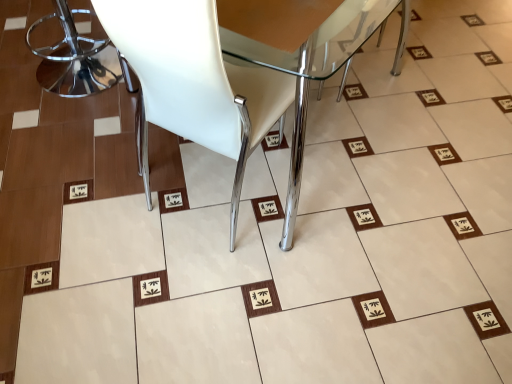
This screenshot has width=512, height=384. Describe the element at coordinates (229, 76) in the screenshot. I see `white matte chair at center, which appears as the first chair when viewed from the right` at that location.

In order to click on white matte chair at center, which appears as the first chair when viewed from the right in this screenshot , I will do `click(229, 76)`.

What do you see at coordinates (76, 59) in the screenshot? The height and width of the screenshot is (384, 512). I see `polished chrome bar stool at left, the 2th chair positioned from the right` at bounding box center [76, 59].

Locate an element on the screen. The width and height of the screenshot is (512, 384). polished chrome bar stool at left, the 2th chair positioned from the right is located at coordinates (76, 59).

Locate an element on the screen. The width and height of the screenshot is (512, 384). white matte chair at center, which is the second chair in left-to-right order is located at coordinates (229, 76).

Considering the relative positions of polished chrome bar stool at left, the 2th chair positioned from the right, and white matte chair at center, which appears as the first chair when viewed from the right, in the image provided, is polished chrome bar stool at left, the 2th chair positioned from the right, to the left of white matte chair at center, which appears as the first chair when viewed from the right, from the viewer's perspective?

Yes.

Is polished chrome bar stool at left, the 2th chair positioned from the right, in front of or behind white matte chair at center, which is the second chair in left-to-right order, in the image?

Visually, polished chrome bar stool at left, the 2th chair positioned from the right, is located behind white matte chair at center, which is the second chair in left-to-right order.

Is point (132, 74) closer or farther from the camera than point (200, 100)?

Point (132, 74) is farther from the camera than point (200, 100).

From the image's perspective, between polished chrome bar stool at left, the 2th chair positioned from the right, and white matte chair at center, which is the second chair in left-to-right order, who is located below?

white matte chair at center, which is the second chair in left-to-right order.

From a real-world perspective, which is physically above, polished chrome bar stool at left, the 2th chair positioned from the right, or white matte chair at center, which appears as the first chair when viewed from the right?

white matte chair at center, which appears as the first chair when viewed from the right, from a real-world perspective.

Can you confirm if polished chrome bar stool at left, the 2th chair positioned from the right, is wider than white matte chair at center, which appears as the first chair when viewed from the right?

In fact, polished chrome bar stool at left, the 2th chair positioned from the right, might be narrower than white matte chair at center, which appears as the first chair when viewed from the right.

From their relative heights in the image, would you say polished chrome bar stool at left, marked as the first chair in a left-to-right arrangement, is taller or shorter than white matte chair at center, which is the second chair in left-to-right order?

In the image, polished chrome bar stool at left, marked as the first chair in a left-to-right arrangement, appears to be shorter than white matte chair at center, which is the second chair in left-to-right order.

Between polished chrome bar stool at left, marked as the first chair in a left-to-right arrangement, and white matte chair at center, which is the second chair in left-to-right order, which one has larger size?

white matte chair at center, which is the second chair in left-to-right order, is bigger.

Do you think polished chrome bar stool at left, the 2th chair positioned from the right, is within white matte chair at center, which is the second chair in left-to-right order, or outside of it?

polished chrome bar stool at left, the 2th chair positioned from the right, exists outside the volume of white matte chair at center, which is the second chair in left-to-right order.

Can you see polished chrome bar stool at left, the 2th chair positioned from the right, touching white matte chair at center, which appears as the first chair when viewed from the right?

→ polished chrome bar stool at left, the 2th chair positioned from the right, and white matte chair at center, which appears as the first chair when viewed from the right, are clearly separated.

Is polished chrome bar stool at left, marked as the first chair in a left-to-right arrangement, facing towards white matte chair at center, which is the second chair in left-to-right order?

Yes, polished chrome bar stool at left, marked as the first chair in a left-to-right arrangement, is oriented towards white matte chair at center, which is the second chair in left-to-right order.

How different are the orientations of polished chrome bar stool at left, the 2th chair positioned from the right, and white matte chair at center, which appears as the first chair when viewed from the right, in degrees?

They differ by 0.384 degrees in their facing directions.

Measure the distance from polished chrome bar stool at left, marked as the first chair in a left-to-right arrangement, to white matte chair at center, which is the second chair in left-to-right order.

A distance of 1.08 meters exists between polished chrome bar stool at left, marked as the first chair in a left-to-right arrangement, and white matte chair at center, which is the second chair in left-to-right order.

The width and height of the screenshot is (512, 384). Identify the location of chair that is above the polished chrome bar stool at left, the 2th chair positioned from the right (from a real-world perspective). (229, 76).

Does white matte chair at center, which is the second chair in left-to-right order, appear on the right side of polished chrome bar stool at left, marked as the first chair in a left-to-right arrangement?

Correct, you'll find white matte chair at center, which is the second chair in left-to-right order, to the right of polished chrome bar stool at left, marked as the first chair in a left-to-right arrangement.

Is white matte chair at center, which appears as the first chair when viewed from the right, further to the viewer compared to polished chrome bar stool at left, marked as the first chair in a left-to-right arrangement?

No, the depth of white matte chair at center, which appears as the first chair when viewed from the right, is less than that of polished chrome bar stool at left, marked as the first chair in a left-to-right arrangement.

Is point (204, 77) positioned behind point (95, 88)?

That is False.

From the image's perspective, is white matte chair at center, which appears as the first chair when viewed from the right, on polished chrome bar stool at left, the 2th chair positioned from the right?

Actually, white matte chair at center, which appears as the first chair when viewed from the right, appears below polished chrome bar stool at left, the 2th chair positioned from the right, in the image.

From a real-world perspective, who is located lower, white matte chair at center, which appears as the first chair when viewed from the right, or polished chrome bar stool at left, marked as the first chair in a left-to-right arrangement?

From a 3D spatial view, polished chrome bar stool at left, marked as the first chair in a left-to-right arrangement, is below.

Can you confirm if white matte chair at center, which is the second chair in left-to-right order, is thinner than polished chrome bar stool at left, the 2th chair positioned from the right?

No.

Between white matte chair at center, which appears as the first chair when viewed from the right, and polished chrome bar stool at left, marked as the first chair in a left-to-right arrangement, which one has less height?

polished chrome bar stool at left, marked as the first chair in a left-to-right arrangement, is shorter.

Does white matte chair at center, which is the second chair in left-to-right order, have a larger size compared to polished chrome bar stool at left, the 2th chair positioned from the right?

Yes, white matte chair at center, which is the second chair in left-to-right order, is bigger than polished chrome bar stool at left, the 2th chair positioned from the right.

Is white matte chair at center, which appears as the first chair when viewed from the right, situated inside polished chrome bar stool at left, marked as the first chair in a left-to-right arrangement, or outside?

white matte chair at center, which appears as the first chair when viewed from the right, is located beyond the bounds of polished chrome bar stool at left, marked as the first chair in a left-to-right arrangement.

Is white matte chair at center, which is the second chair in left-to-right order, in contact with polished chrome bar stool at left, marked as the first chair in a left-to-right arrangement?

No, white matte chair at center, which is the second chair in left-to-right order, is not next to polished chrome bar stool at left, marked as the first chair in a left-to-right arrangement.

Is white matte chair at center, which is the second chair in left-to-right order, facing away from polished chrome bar stool at left, the 2th chair positioned from the right?

Yes, white matte chair at center, which is the second chair in left-to-right order,'s orientation is away from polished chrome bar stool at left, the 2th chair positioned from the right.

Can you tell me how much white matte chair at center, which is the second chair in left-to-right order, and polished chrome bar stool at left, marked as the first chair in a left-to-right arrangement, differ in facing direction?

The angular difference between white matte chair at center, which is the second chair in left-to-right order, and polished chrome bar stool at left, marked as the first chair in a left-to-right arrangement, is 0.384 degrees.

Where is `chair lying behind the white matte chair at center, which appears as the first chair when viewed from the right`? The image size is (512, 384). chair lying behind the white matte chair at center, which appears as the first chair when viewed from the right is located at coordinates (76, 59).

Locate an element on the screen. The height and width of the screenshot is (384, 512). chair on the right of polished chrome bar stool at left, the 2th chair positioned from the right is located at coordinates (229, 76).

Locate an element on the screen. This screenshot has width=512, height=384. chair behind the white matte chair at center, which is the second chair in left-to-right order is located at coordinates (76, 59).